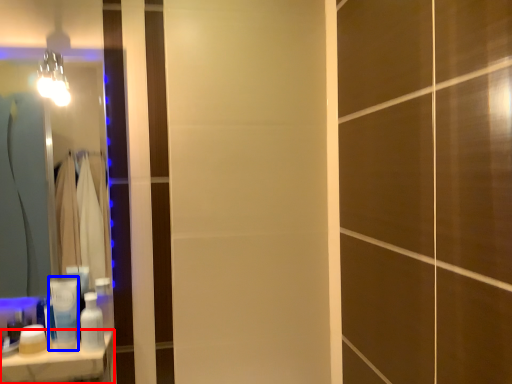
Question: Which point is further to the camera, counter top (highlighted by a red box) or toiletry (highlighted by a blue box)?

Choices:
 (A) counter top
 (B) toiletry

Answer: (B)